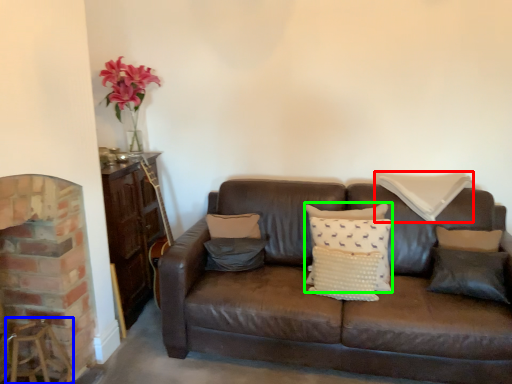
Question: Which object is the closest to the pillow (highlighted by a red box)? Choose among these: bar stool (highlighted by a blue box) or pillow (highlighted by a green box).

Choices:
 (A) bar stool
 (B) pillow

Answer: (B)